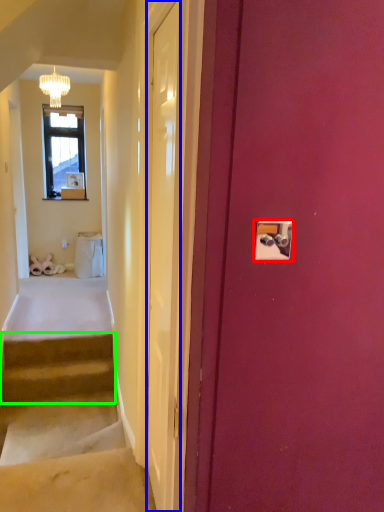
Question: Based on their relative distances, which object is nearer to light switch (highlighted by a red box)? Choose from door (highlighted by a blue box) and stairs (highlighted by a green box).

Choices:
 (A) door
 (B) stairs

Answer: (A)